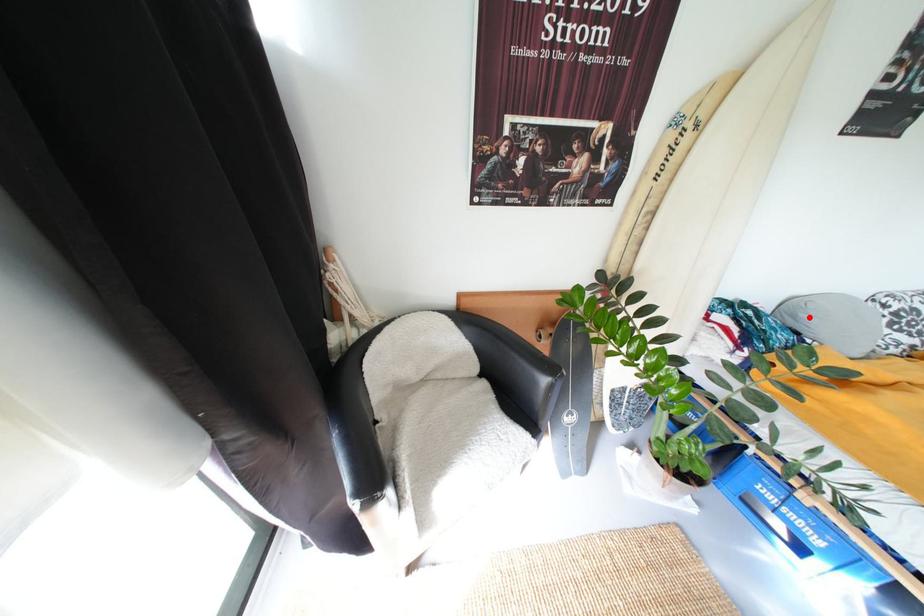
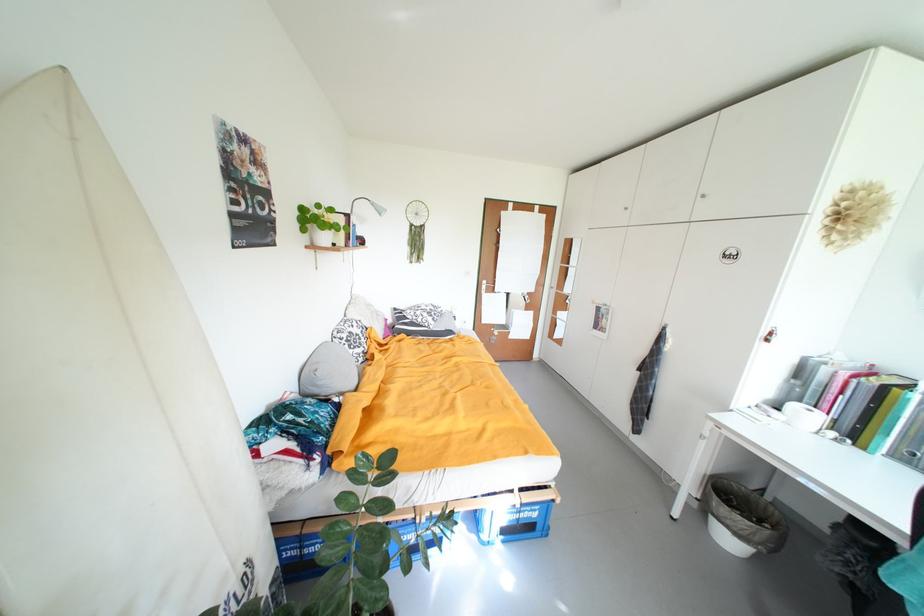
Question: I am providing you with two images of the same scene from different viewpoints. In image1, a red point is highlighted. Considering the same 3D point in image2, which of the following is correct?

Choices:
 (A) It is closer
 (B) It is farther

Answer: (A)